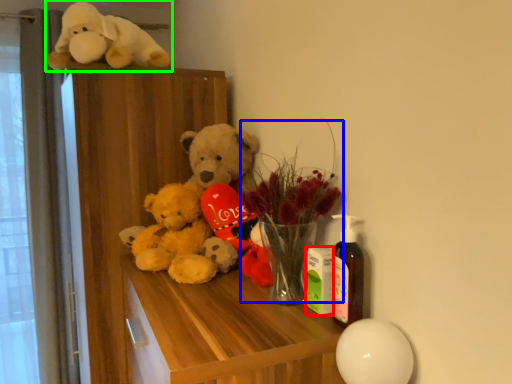
Question: Which object is the closest to the toy (highlighted by a red box)? Choose among these: floral arrangement (highlighted by a blue box) or toy (highlighted by a green box).

Choices:
 (A) floral arrangement
 (B) toy

Answer: (A)